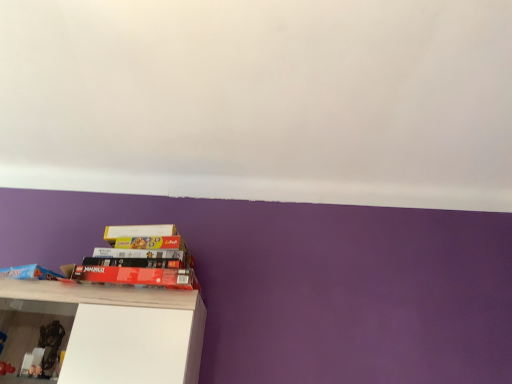
Question: Does matte black book at lower left, which is counted as the first book, starting from the right, come in front of matte blue book at lower left, the second book in the right-to-left sequence?

Choices:
 (A) no
 (B) yes

Answer: (A)

Question: From the image's perspective, is matte black book at lower left, acting as the 2th book starting from the left, beneath matte blue book at lower left, which ranks as the first book in left-to-right order?

Choices:
 (A) no
 (B) yes

Answer: (A)

Question: Would you say matte black book at lower left, which is counted as the first book, starting from the right, is outside matte blue book at lower left, which ranks as the first book in left-to-right order?

Choices:
 (A) yes
 (B) no

Answer: (A)

Question: From a real-world perspective, is matte black book at lower left, which is counted as the first book, starting from the right, over matte blue book at lower left, which ranks as the first book in left-to-right order?

Choices:
 (A) no
 (B) yes

Answer: (B)

Question: Is matte black book at lower left, which is counted as the first book, starting from the right, bigger than matte blue book at lower left, which ranks as the first book in left-to-right order?

Choices:
 (A) yes
 (B) no

Answer: (A)

Question: Considering the positions of white glossy shelf at lower left and matte black book at lower left, which is counted as the first book, starting from the right, in the image, is white glossy shelf at lower left taller or shorter than matte black book at lower left, which is counted as the first book, starting from the right,?

Choices:
 (A) tall
 (B) short

Answer: (A)

Question: In the image, is white glossy shelf at lower left on the left side or the right side of matte black book at lower left, which is counted as the first book, starting from the right?

Choices:
 (A) right
 (B) left

Answer: (B)

Question: Is white glossy shelf at lower left inside the boundaries of matte black book at lower left, which is counted as the first book, starting from the right, or outside?

Choices:
 (A) outside
 (B) inside

Answer: (A)

Question: From a real-world perspective, is white glossy shelf at lower left positioned above or below matte black book at lower left, which is counted as the first book, starting from the right?

Choices:
 (A) above
 (B) below

Answer: (B)

Question: Looking at their shapes, would you say matte black book at lower left, acting as the 2th book starting from the left, is wider or thinner than matte blue book at lower left, which ranks as the first book in left-to-right order?

Choices:
 (A) thin
 (B) wide

Answer: (B)

Question: Is matte black book at lower left, which is counted as the first book, starting from the right, taller or shorter than matte blue book at lower left, the second book in the right-to-left sequence?

Choices:
 (A) tall
 (B) short

Answer: (B)

Question: Is matte black book at lower left, acting as the 2th book starting from the left, situated inside matte blue book at lower left, the second book in the right-to-left sequence, or outside?

Choices:
 (A) inside
 (B) outside

Answer: (B)

Question: In the image, is matte black book at lower left, acting as the 2th book starting from the left, on the left side or the right side of matte blue book at lower left, which ranks as the first book in left-to-right order?

Choices:
 (A) right
 (B) left

Answer: (A)

Question: Is matte blue book at lower left, the second book in the right-to-left sequence, in front of or behind matte black book at lower left, acting as the 2th book starting from the left, in the image?

Choices:
 (A) behind
 (B) front

Answer: (B)

Question: From the image's perspective, relative to matte black book at lower left, which is counted as the first book, starting from the right, is matte blue book at lower left, the second book in the right-to-left sequence, above or below?

Choices:
 (A) above
 (B) below

Answer: (B)